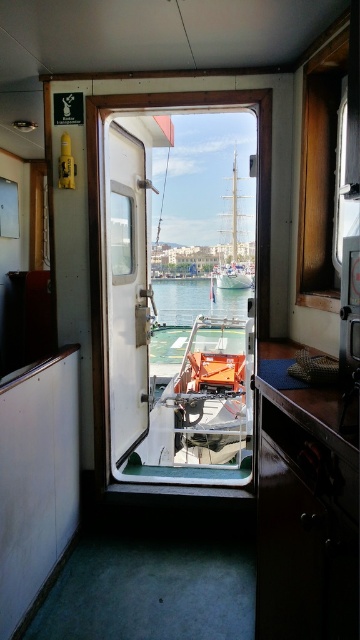
Is point (167, 365) positioned before point (234, 259)?

Yes, point (167, 365) is in front of point (234, 259).

Locate an element on the screen. transparent glass window at center is located at coordinates (180, 296).

Between point (119, 189) and point (236, 310), which one is positioned behind?

The point (236, 310) is more distant.

Find the location of a particular element. transparent glass window at center is located at coordinates (180, 296).

Is point (122, 172) farther from camera compared to point (185, 296)?

No.

Which is behind, point (137, 365) or point (192, 294)?

Point (192, 294)

This screenshot has height=640, width=360. Find the location of `white glossy door at center`. white glossy door at center is located at coordinates (128, 291).

Identify the location of white glossy door at center. (128, 291).